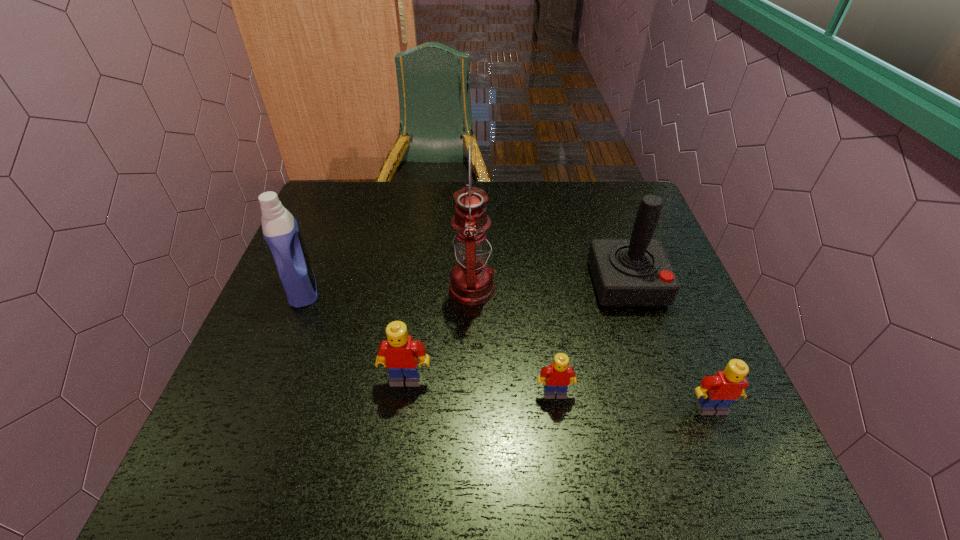
At what (x,y) coordinates should I click in order to perform the action: click on the leftmost Lego. Please return your answer as a coordinate pair (x, y). Looking at the image, I should click on point(399,353).

Find the location of a particular element. the third object from right to left is located at coordinates (559, 375).

Identify the location of the shortest object. (559, 375).

Image resolution: width=960 pixels, height=540 pixels. Identify the location of the second shortest Lego. (715, 395).

I want to click on the rightmost Lego, so click(715, 395).

At what (x,y) coordinates should I click in order to perform the action: click on the tallest object. Please return your answer as a coordinate pair (x, y). Image resolution: width=960 pixels, height=540 pixels. Looking at the image, I should click on (472, 283).

You are a GUI agent. You are given a task and a screenshot of the screen. Output one action in this format:
    pyautogui.click(x=<x>, y=<y>)
    Task: Click on the oil lamp
    This screenshot has height=540, width=960.
    Given the screenshot: What is the action you would take?
    pyautogui.click(x=472, y=283)

This screenshot has width=960, height=540. Find the location of `joystick`. joystick is located at coordinates (626, 272).

This screenshot has width=960, height=540. What are the coordinates of `detergent` in the screenshot? It's located at (280, 229).

Find the location of `vacant area situated on the front-facing side of the leftmost Lego`. vacant area situated on the front-facing side of the leftmost Lego is located at coordinates (x=399, y=428).